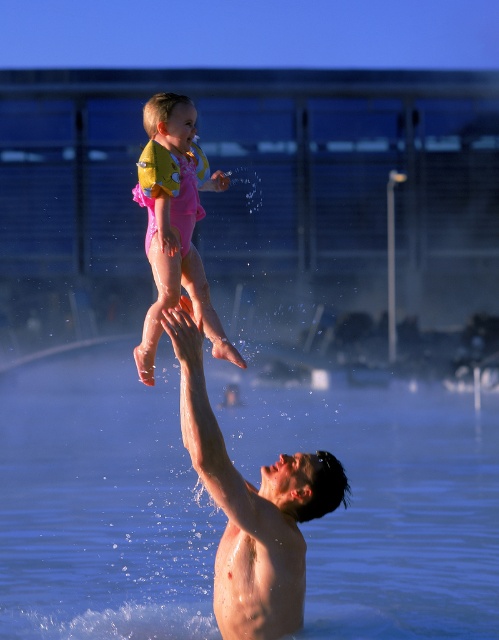
Is skinny white man at center thinner than pink rubber swimsuit at upper center?

No.

Does point (303, 548) come in front of point (214, 177)?

Yes, point (303, 548) is in front of point (214, 177).

You are a GUI agent. You are given a task and a screenshot of the screen. Output one action in this format:
    pyautogui.click(x=<x>, y=<y>)
    Task: Click on the skinny white man at center
    This screenshot has width=499, height=640.
    Given the screenshot: What is the action you would take?
    pyautogui.click(x=251, y=508)

Who is more distant from viewer, (330, 560) or (171, 314)?

Point (330, 560)

Is clear blue water at upper center taller than skinny white man at center?

Yes.

In the scene shown: Measure the distance between clear blue water at upper center and camera.

37.66 feet

Identify the location of clear blue water at upper center. click(x=100, y=504).

Is clear blue water at upper center closer to camera compared to pink rubber swimsuit at upper center?

Yes, clear blue water at upper center is closer to the viewer.

Which is in front, point (138, 589) or point (155, 209)?

Positioned in front is point (155, 209).

This screenshot has width=499, height=640. What are the coordinates of `clear blue water at upper center` in the screenshot? It's located at (100, 504).